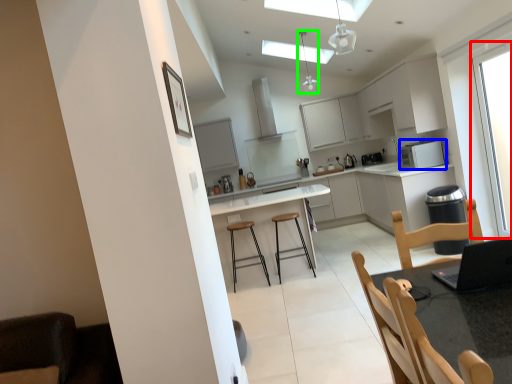
Question: Which object is positioned closest to window (highlighted by a red box)? Select from appliance (highlighted by a blue box) and light fixture (highlighted by a green box).

Choices:
 (A) appliance
 (B) light fixture

Answer: (A)